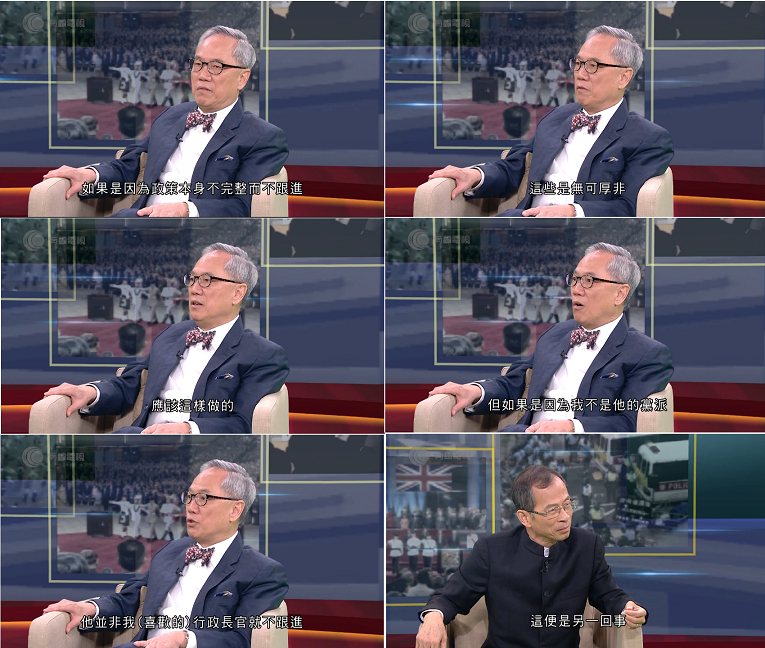
You are a GUI agent. You are given a task and a screenshot of the screen. Output one action in this format:
    pyautogui.click(x=<x>, y=<y>)
    Task: Click on the right armrest
    The image size is (765, 648).
    Given the screenshot: What is the action you would take?
    pyautogui.click(x=41, y=210), pyautogui.click(x=41, y=418), pyautogui.click(x=430, y=205), pyautogui.click(x=430, y=411), pyautogui.click(x=41, y=637), pyautogui.click(x=457, y=626)